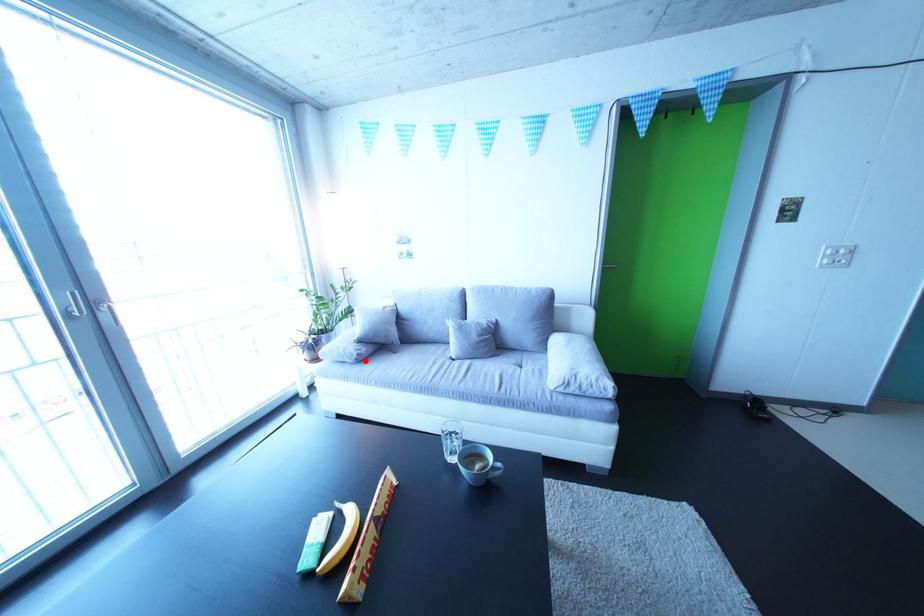
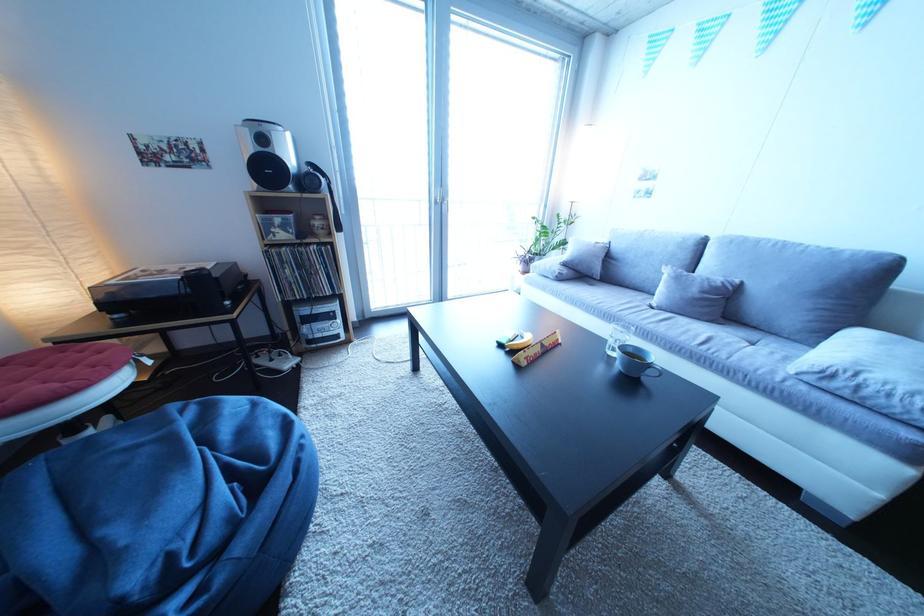
In the second image, find the point that corresponds to the highlighted location in the first image.

(567, 278)